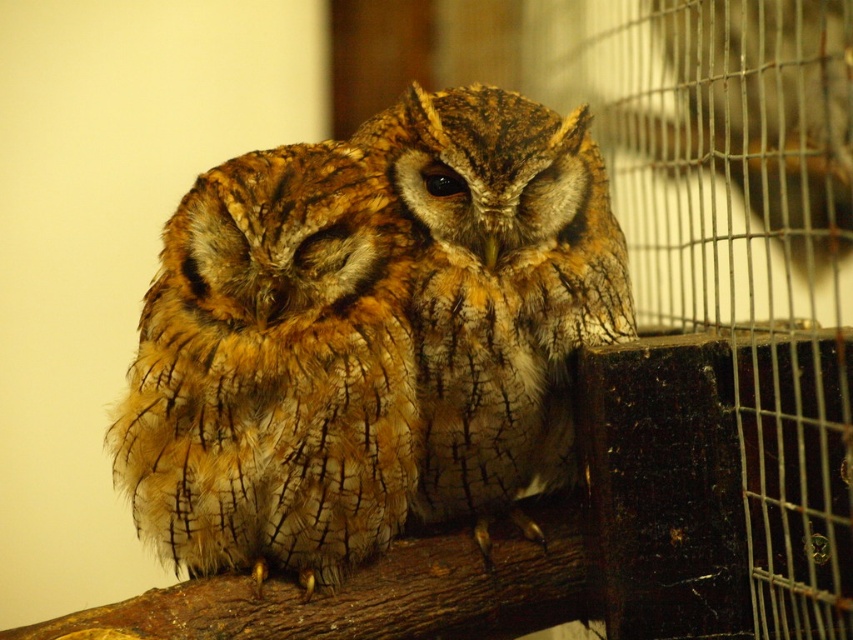
Question: Which point is farther to the camera?

Choices:
 (A) brown speckled owl at center
 (B) brown textured owl at center

Answer: (A)

Question: Observing the image, what is the correct spatial positioning of brown textured owl at center in reference to brown speckled owl at center?

Choices:
 (A) right
 (B) left

Answer: (B)

Question: Among these points, which one is farthest from the camera?

Choices:
 (A) click(x=196, y=442)
 (B) click(x=431, y=305)

Answer: (B)

Question: Among these objects, which one is farthest from the camera?

Choices:
 (A) brown textured owl at center
 (B) brown speckled owl at center

Answer: (B)

Question: Is brown textured owl at center further to camera compared to brown speckled owl at center?

Choices:
 (A) no
 (B) yes

Answer: (A)

Question: Can you confirm if brown textured owl at center is thinner than brown speckled owl at center?

Choices:
 (A) yes
 (B) no

Answer: (B)